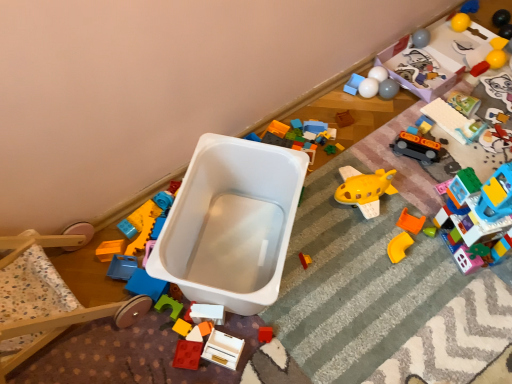
Locate an element on the screen. free spot behind white plastic toy at center, the 14th toy when ordered from right to left is located at coordinates (228, 259).